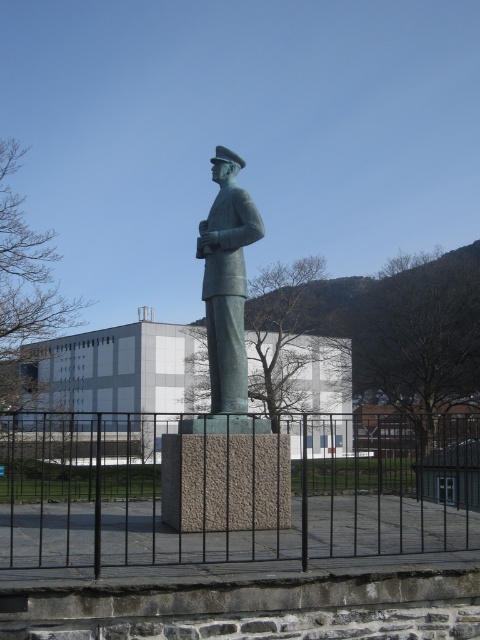
Question: Is black metal fence at center further to camera compared to bronze statue at center?

Choices:
 (A) yes
 (B) no

Answer: (B)

Question: Considering the relative positions of black metal fence at center and bronze statue at center in the image provided, where is black metal fence at center located with respect to bronze statue at center?

Choices:
 (A) below
 (B) above

Answer: (A)

Question: Which point appears closest to the camera in this image?

Choices:
 (A) (x=96, y=520)
 (B) (x=208, y=308)

Answer: (A)

Question: Which object is closer to the camera taking this photo?

Choices:
 (A) bronze statue at center
 (B) black metal fence at center

Answer: (B)

Question: Does black metal fence at center have a larger size compared to bronze statue at center?

Choices:
 (A) no
 (B) yes

Answer: (B)

Question: Among these points, which one is farthest from the camera?

Choices:
 (A) (177, 436)
 (B) (219, 161)

Answer: (B)